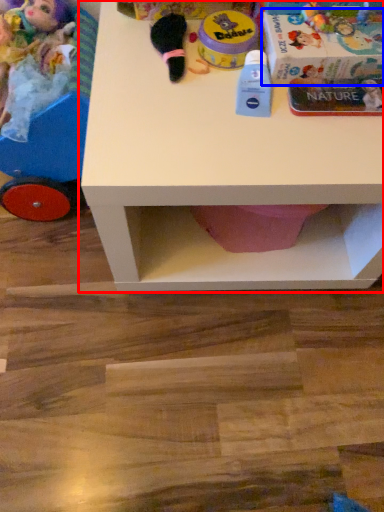
Question: Among these objects, which one is nearest to the camera, table (highlighted by a red box) or box (highlighted by a blue box)?

Choices:
 (A) table
 (B) box

Answer: (A)